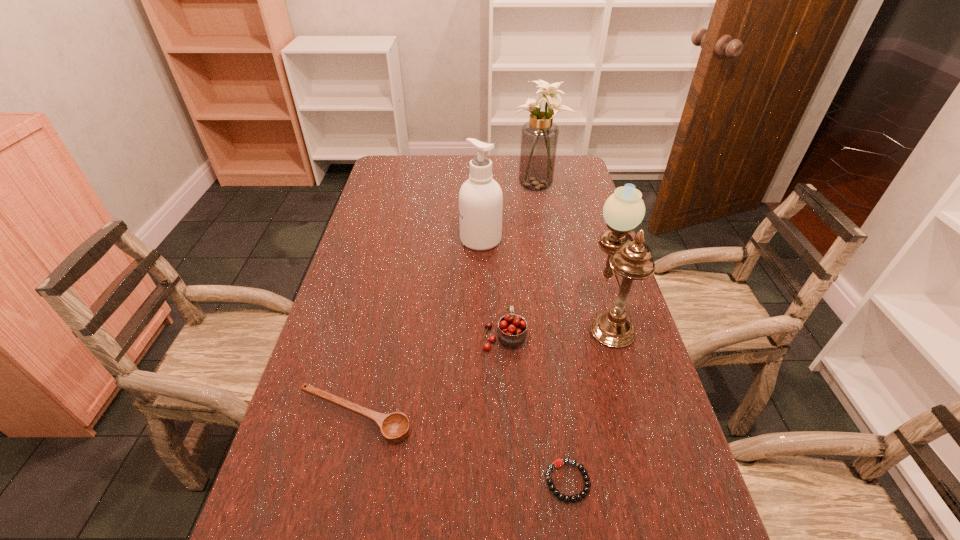
Identify the location of vacant point located on the front label of the second farthest object. This screenshot has height=540, width=960. (372, 240).

At what (x,y) coordinates should I click in order to perform the action: click on free point located 0.200m on the front label of the second farthest object. Please return your answer as a coordinate pair (x, y). Looking at the image, I should click on (397, 240).

Find the location of a particular element. free spot located 0.190m on the front label of the second farthest object is located at coordinates (400, 240).

The height and width of the screenshot is (540, 960). I want to click on free space located on the handle side of the cherry, so click(501, 279).

Identify the location of vacant position located on the handle side of the cherry. This screenshot has height=540, width=960. (498, 230).

Where is `vacant space located on the handle side of the cherry`? This screenshot has width=960, height=540. vacant space located on the handle side of the cherry is located at coordinates (499, 235).

Identify the location of vacant point located on the back of the second nearest object. (372, 340).

Where is `free space located on the back of the bracelet`? free space located on the back of the bracelet is located at coordinates (561, 436).

Locate an element on the screen. The image size is (960, 540). object at the far edge is located at coordinates (539, 136).

The image size is (960, 540). In order to click on object present at the left edge in this screenshot , I will do `click(394, 427)`.